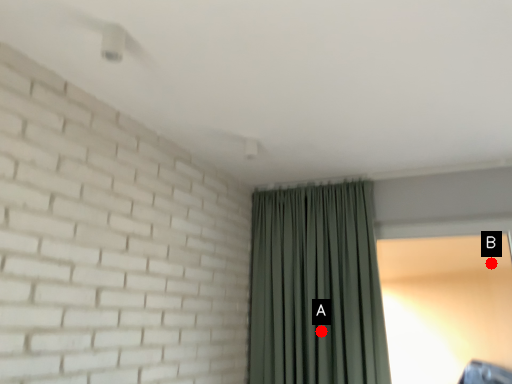
Question: Two points are circled on the image, labeled by A and B beside each circle. Which point is closer to the camera taking this photo?

Choices:
 (A) A is closer
 (B) B is closer

Answer: (A)